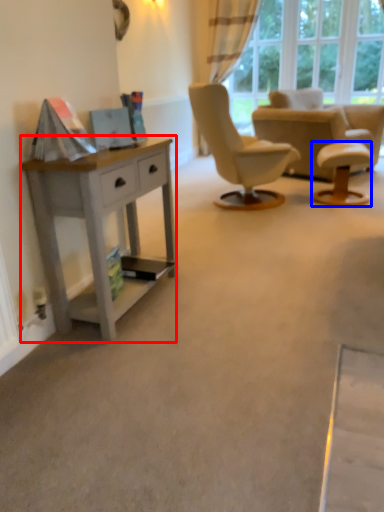
Question: Which object appears closest to the camera in this image, desk (highlighted by a red box) or stool (highlighted by a blue box)?

Choices:
 (A) desk
 (B) stool

Answer: (A)